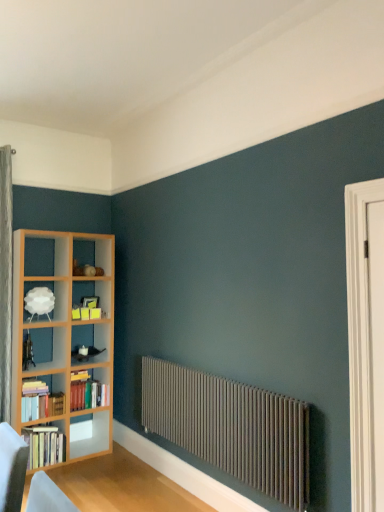
Question: Is hardcover books at left, which is counted as the second book, starting from the top, spatially inside white matte lampshade at upper left, or outside of it?

Choices:
 (A) outside
 (B) inside

Answer: (A)

Question: In the image, is hardcover books at left, which is counted as the second book, starting from the top, on the left side or the right side of white matte lampshade at upper left?

Choices:
 (A) right
 (B) left

Answer: (A)

Question: Estimate the real-world distances between objects in this image. Which object is closer to the hardcover books at left, marked as the 3th book in a bottom-to-top arrangement?

Choices:
 (A) matte gray radiator at lower center
 (B) white wooden door at right
 (C) white matte lampshade at upper left
 (D) hardcover books at left, positioned as the 1th book in bottom-to-top order
 (E) hardcover books at left, arranged as the 2th book when ordered from the bottom

Answer: (D)

Question: Considering the real-world distances, which object is closest to the white wooden door at right?

Choices:
 (A) hardcover books at left, the 1th book when ordered from top to bottom
 (B) hardcover books at left, arranged as the 2th book when ordered from the bottom
 (C) hardcover books at left, positioned as the 1th book in bottom-to-top order
 (D) white matte lampshade at upper left
 (E) matte gray radiator at lower center

Answer: (E)